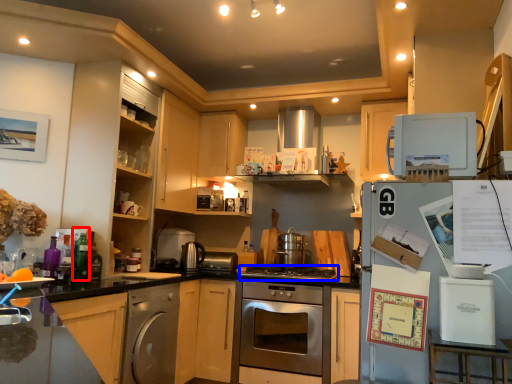
Question: Which of the following is the farthest to the observer, bottle (highlighted by a red box) or gas stove (highlighted by a blue box)?

Choices:
 (A) bottle
 (B) gas stove

Answer: (B)